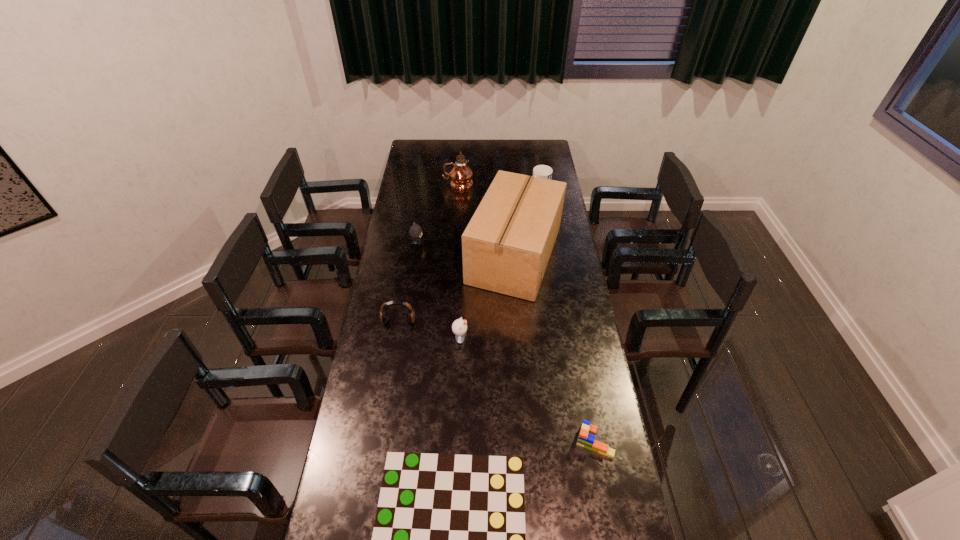
You are a GUI agent. You are given a task and a screenshot of the screen. Output one action in this format:
    pyautogui.click(x=<x>, y=<y>)
    Task: Click on the free spot located 0.260m on the left of the mug
    
    Given the screenshot: What is the action you would take?
    pyautogui.click(x=479, y=190)

Where is `vacant space situated on the ear cups of the fifth farthest object`? The width and height of the screenshot is (960, 540). vacant space situated on the ear cups of the fifth farthest object is located at coordinates (393, 359).

The height and width of the screenshot is (540, 960). Identify the location of vacant space situated 0.070m on the front-facing side of the left kitten. (438, 244).

Where is `vacant region located 0.190m on the front-facing side of the right kitten`? vacant region located 0.190m on the front-facing side of the right kitten is located at coordinates (516, 339).

At what (x,y) coordinates should I click in order to perform the action: click on vacant space situated on the front of the seventh tallest object. Please return your answer as a coordinate pair (x, y). This screenshot has height=540, width=960. Looking at the image, I should click on (601, 481).

Identify the location of headset situated at the left edge. (383, 311).

Locate an element on the screen. The width and height of the screenshot is (960, 540). kitten that is at the left edge is located at coordinates (415, 231).

The height and width of the screenshot is (540, 960). Identify the location of box situated at the right edge. (506, 247).

Locate an element on the screen. mug that is at the right edge is located at coordinates (542, 171).

Identify the location of Lego positioned at the right edge. This screenshot has height=540, width=960. (586, 438).